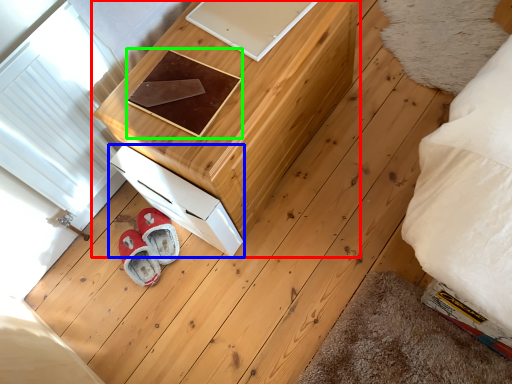
Question: Based on their relative distances, which object is nearer to furniture (highlighted by a red box)? Choose from drawer (highlighted by a blue box) and pad (highlighted by a green box).

Choices:
 (A) drawer
 (B) pad

Answer: (B)